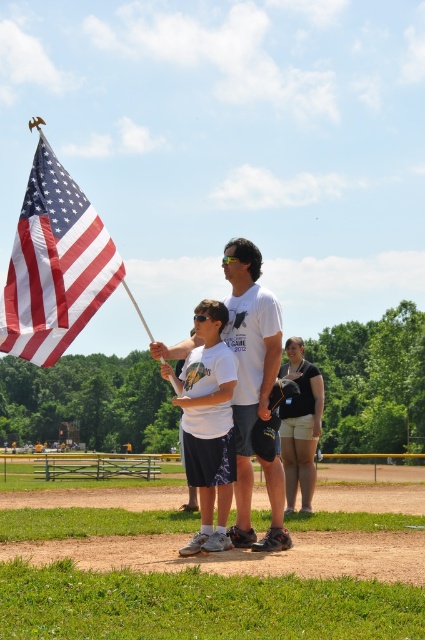
Is american flag at left wider than black fabric backpack at center?

Indeed, american flag at left has a greater width compared to black fabric backpack at center.

Between point (51, 253) and point (323, 401), which one is positioned in front?

Positioned in front is point (51, 253).

What do you see at coordinates (54, 264) in the screenshot? The height and width of the screenshot is (640, 425). I see `american flag at left` at bounding box center [54, 264].

What are the coordinates of `american flag at left` in the screenshot? It's located at (54, 264).

Is american flag at left taller than white matte shirt at center?

In fact, american flag at left may be shorter than white matte shirt at center.

Does american flag at left have a lesser width compared to white matte shirt at center?

No, american flag at left is not thinner than white matte shirt at center.

I want to click on american flag at left, so click(54, 264).

Does white matte t-shirt at center have a smaller size compared to white matte shirt at center?

No.

Is point (260, 269) less distant than point (167, 364)?

That is False.

Image resolution: width=425 pixels, height=640 pixels. I want to click on white matte t-shirt at center, so click(254, 392).